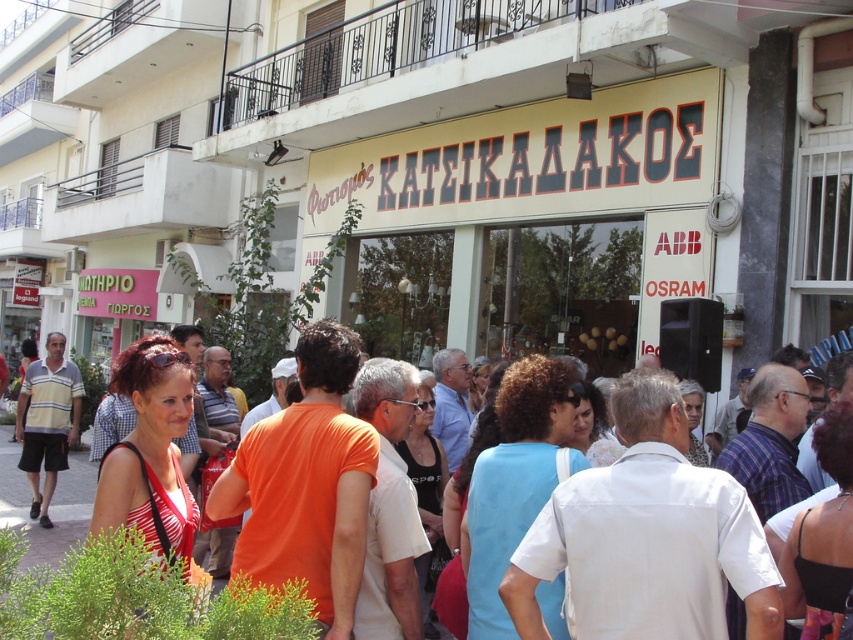
Question: Can you confirm if orange t-shirt at center is bigger than striped cotton shirt at left?

Choices:
 (A) yes
 (B) no

Answer: (B)

Question: Can you confirm if orange t-shirt at center is positioned to the right of striped cotton shirt at left?

Choices:
 (A) yes
 (B) no

Answer: (A)

Question: Which point appears closest to the camera in this image?

Choices:
 (A) (28, 432)
 (B) (93, 625)

Answer: (B)

Question: Does orange t-shirt at center have a smaller size compared to striped cotton shirt at left?

Choices:
 (A) no
 (B) yes

Answer: (B)